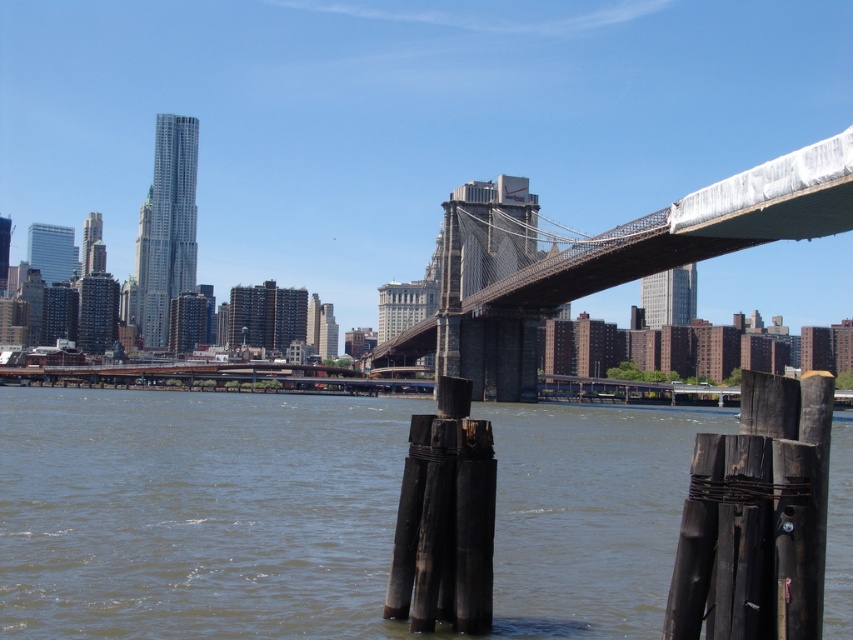
Is point (80, 404) closer to camera compared to point (782, 172)?

No.

Is brown wooden posts at lower center thinner than metallic gray bridge at center?

No, brown wooden posts at lower center is not thinner than metallic gray bridge at center.

This screenshot has height=640, width=853. Find the location of `brown wooden posts at lower center`. brown wooden posts at lower center is located at coordinates (196, 513).